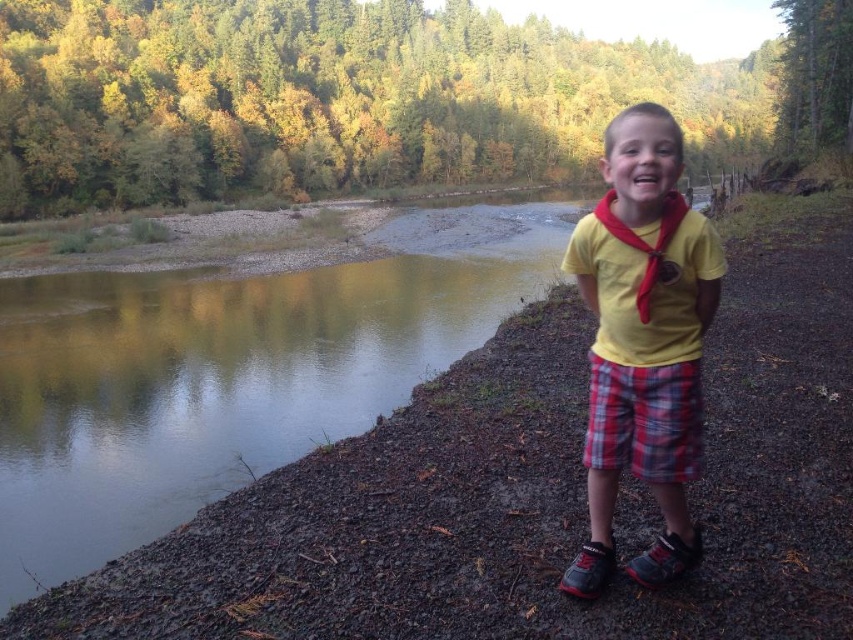
You are standing at the center of the image. Which direction should you look to see the green reflective water at lower left?

The green reflective water at lower left is located at point (230, 372), so you should look to the lower left direction to see it.

You are a photographer trying to capture the boy in the scene. Since the green reflective water at lower left and the yellow cotton shirt at center are both in the frame, which one appears taller in the photo?

The green reflective water at lower left appears taller than the yellow cotton shirt at center in the photo.

The boy is wearing a yellow cotton shirt at center and plaid fabric shorts at right. Which piece of clothing is closer to you?

The yellow cotton shirt at center is closer to the viewer than the plaid fabric shorts at right.